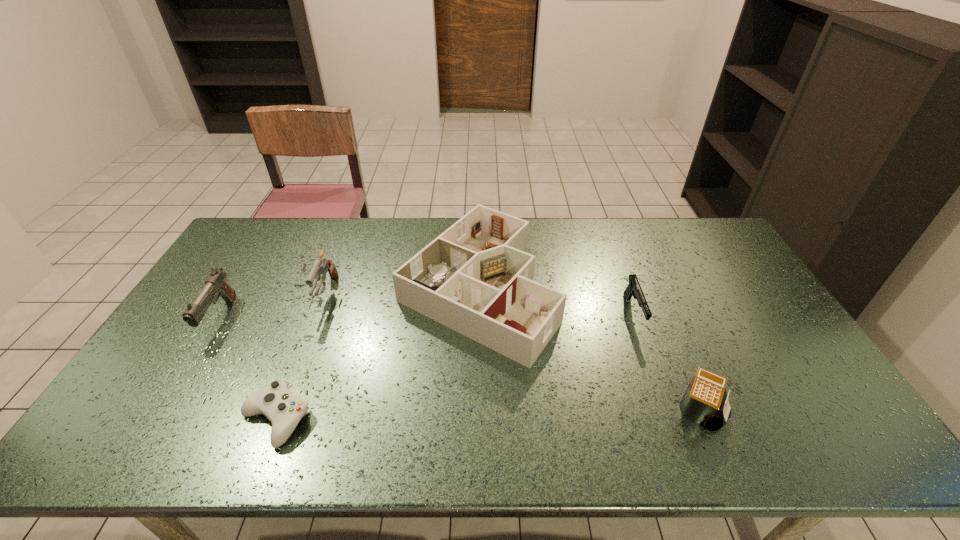
Find the location of `the second gun from left to right`. the second gun from left to right is located at coordinates (320, 266).

The height and width of the screenshot is (540, 960). I want to click on the leftmost object, so click(216, 285).

In order to click on the fourth object from left to right in this screenshot , I will do `click(475, 278)`.

Find the location of a particular element. the rightmost gun is located at coordinates (634, 289).

At what (x,y) coordinates should I click in order to perform the action: click on the second object from right to left. Please return your answer as a coordinate pair (x, y). Looking at the image, I should click on (634, 289).

Where is `the rightmost object`? The height and width of the screenshot is (540, 960). the rightmost object is located at coordinates (703, 402).

Find the location of a particular element. This screenshot has width=960, height=540. control is located at coordinates (275, 401).

Locate an element on the screen. The image size is (960, 540). free space located 0.220m at the barrel end of the second gun from right to left is located at coordinates (291, 375).

Where is `free location located 0.170m in the direction the leftmost gun is aimed`? This screenshot has width=960, height=540. free location located 0.170m in the direction the leftmost gun is aimed is located at coordinates (172, 398).

Find the location of a particular element. This screenshot has height=540, width=960. vacant space situated on the right of the dollhouse is located at coordinates (630, 287).